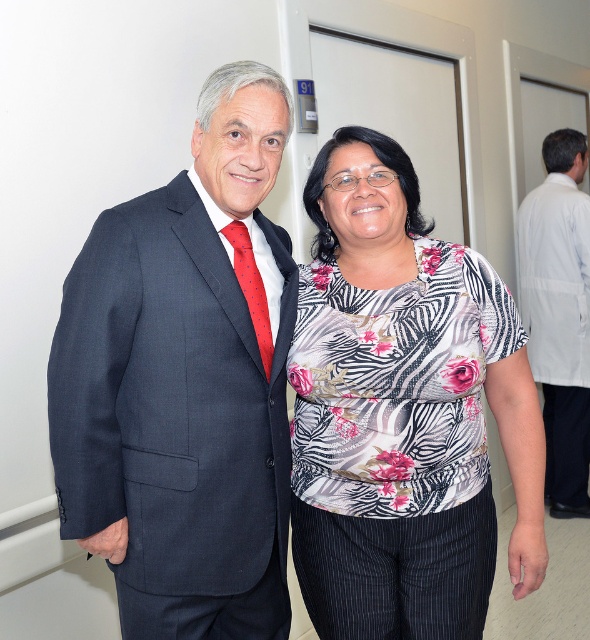
Which is below, floral printed blouse at center or white lab coat at right?

Positioned lower is floral printed blouse at center.

Between floral printed blouse at center and white lab coat at right, which one appears on the right side from the viewer's perspective?

white lab coat at right is more to the right.

Does point (453, 376) come behind point (578, 193)?

No, it is in front of (578, 193).

The width and height of the screenshot is (590, 640). Identify the location of floral printed blouse at center. (402, 412).

Is dark blue textured suit at left to the right of red dotted fabric tie at left from the viewer's perspective?

In fact, dark blue textured suit at left is to the left of red dotted fabric tie at left.

Between point (145, 442) and point (240, 244), which one is positioned behind?

Point (240, 244)

Where is `dark blue textured suit at left`? The width and height of the screenshot is (590, 640). dark blue textured suit at left is located at coordinates [x=175, y=413].

At what (x,y) coordinates should I click in order to perform the action: click on dark blue textured suit at left. Please return your answer as a coordinate pair (x, y). Looking at the image, I should click on (175, 413).

Can you confirm if white lab coat at right is positioned to the right of red dotted fabric tie at left?

Indeed, white lab coat at right is positioned on the right side of red dotted fabric tie at left.

Which is above, white lab coat at right or red dotted fabric tie at left?

red dotted fabric tie at left is higher up.

Who is more distant from viewer, (523, 236) or (240, 221)?

The point (523, 236) is behind.

The image size is (590, 640). I want to click on white lab coat at right, so click(x=559, y=314).